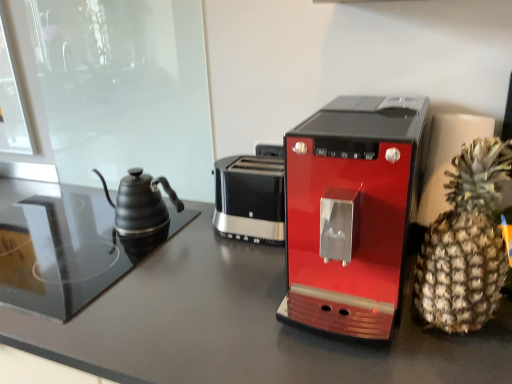
Identify the location of empty space that is ontop of black plastic toaster at center. (255, 164).